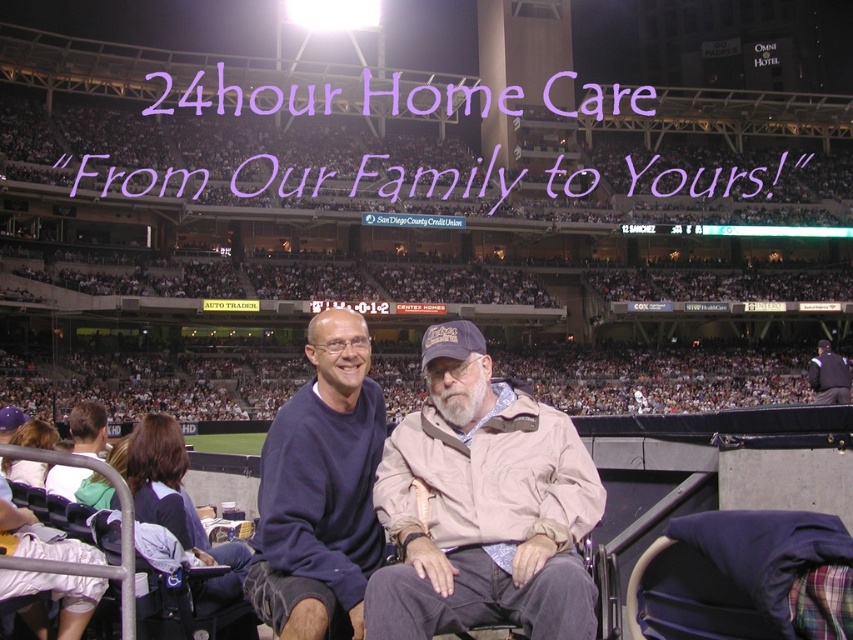
You are attending a baseball game and want to know which of the two people in the foreground has a wider garment. The beige fabric jacket at center and the light blue shirt at lower left are both visible. Which one has a wider garment?

The light blue shirt at lower left has a greater width compared to the beige fabric jacket at center, so the light blue shirt at lower left is wider.

You are sitting in the baseball stadium and want to borrow a jacket from someone nearby. You see the beige fabric jacket at center and the light blue shirt at lower left. Which one is located to the right of the other?

The beige fabric jacket at center is positioned on the right side of light blue shirt at lower left.

You are sitting in the baseball stadium stands and want to get a better view of the game. There are two people in front of you. One is wearing a beige fabric jacket at center and the other a light blue shirt at lower left. Which person is blocking your view more?

The beige fabric jacket at center is blocking your view more because it is in front of the light blue shirt at lower left.